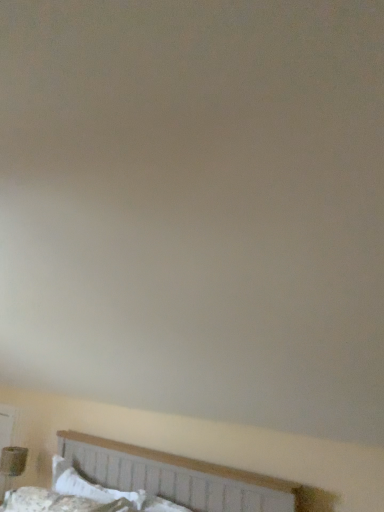
Question: From a real-world perspective, relative to matte brown table lamp at lower left, is white fabric bed at lower center vertically above or below?

Choices:
 (A) above
 (B) below

Answer: (A)

Question: Is white fabric bed at lower center inside or outside of matte brown table lamp at lower left?

Choices:
 (A) inside
 (B) outside

Answer: (B)

Question: Which of these objects is positioned closest to the white fabric bed at lower center?

Choices:
 (A) matte brown table lamp at lower left
 (B) white cotton pillow at lower left

Answer: (B)

Question: Which object is positioned farthest from the white fabric bed at lower center?

Choices:
 (A) matte brown table lamp at lower left
 (B) white cotton pillow at lower left

Answer: (A)